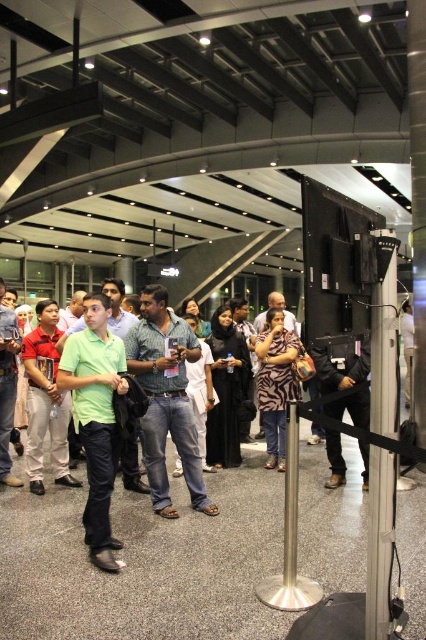
You are attending an event and want to take a photo of the metallic pole at center without anyone blocking it. Since the green matte shirt at center is in the way, can you move around it to get an unobstructed view?

The metallic pole at center is behind the green matte shirt at center, so moving around the green matte shirt at center should allow you to see the metallic pole at center without obstruction.